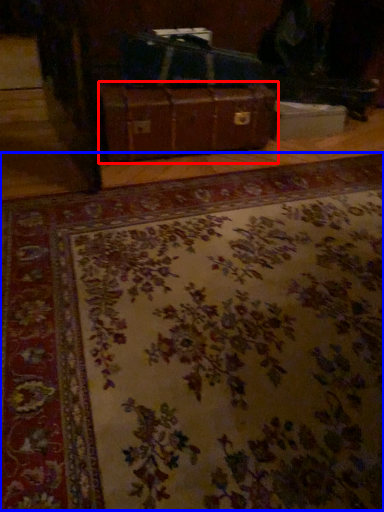
Question: Which point is closer to the camera, suitcase (highlighted by a red box) or mat (highlighted by a blue box)?

Choices:
 (A) suitcase
 (B) mat

Answer: (B)